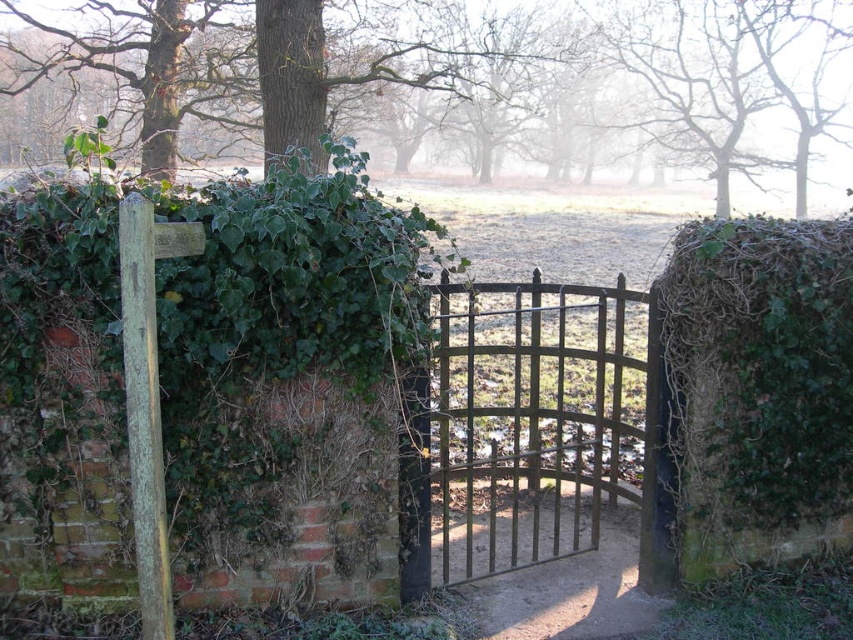
The image size is (853, 640). What do you see at coordinates (537, 419) in the screenshot?
I see `brown metal gate at center` at bounding box center [537, 419].

Is brown metal gate at center shorter than green leafy tree at upper left?

Correct, brown metal gate at center is not as tall as green leafy tree at upper left.

What do you see at coordinates (537, 419) in the screenshot? I see `brown metal gate at center` at bounding box center [537, 419].

At what (x,y) coordinates should I click in order to perform the action: click on brown metal gate at center. Please return your answer as a coordinate pair (x, y). The image size is (853, 640). Looking at the image, I should click on (537, 419).

Can you confirm if green ivy at right is wider than green leafy tree at upper left?

No.

Is point (833, 417) closer to viewer compared to point (3, 17)?

Yes, it is in front of point (3, 17).

Is point (804, 531) positioned before point (773, 125)?

Yes, point (804, 531) is closer to viewer.

Identify the location of green ivy at right. The height and width of the screenshot is (640, 853). (753, 387).

Does green ivy at right have a larger size compared to dirt path at center?

Indeed, green ivy at right has a larger size compared to dirt path at center.

Between point (695, 547) and point (607, 520), which one is positioned behind?

Point (607, 520)

Is point (711, 563) farther from camera compared to point (640, 595)?

No, (711, 563) is closer to viewer.

Find the location of a particular element. Image resolution: width=853 pixels, height=640 pixels. green ivy at right is located at coordinates (753, 387).